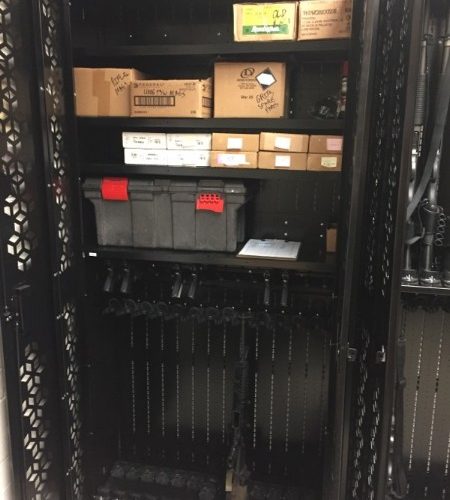
I want to click on black toolbox, so click(x=189, y=224).